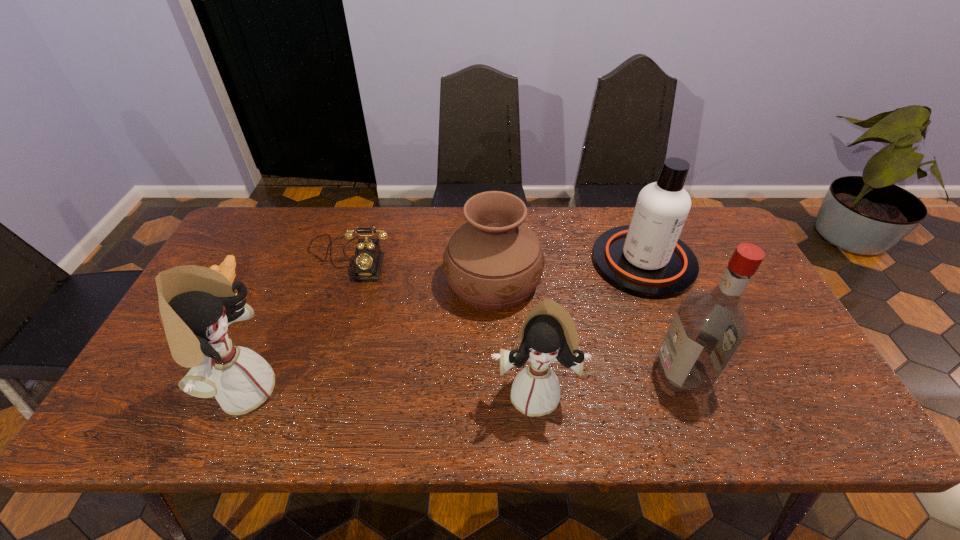
Please show where to add a doll on the right while keeping spacing even. Please provide its 2D coordinates. Your answer should be formatted as a tuple, i.e. [(x, y)], where the tuple contains the x and y coordinates of a point satisfying the conditions above.

[(828, 395)]